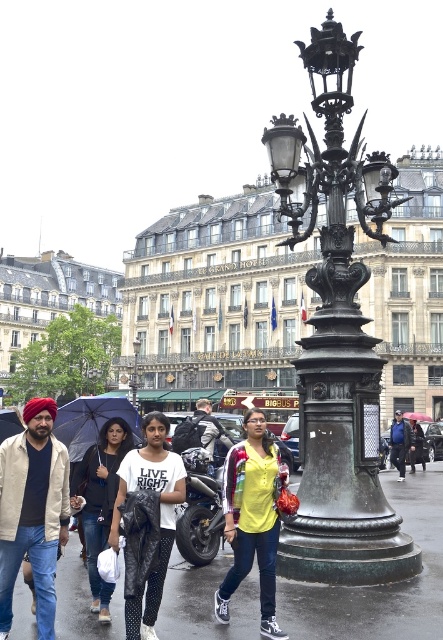
You are a delivery rider who needs to park your motorcycle in a covered area to avoid the rain. Can the shiny black motorcycle at center fit under the transparent plastic umbrella at center?

The shiny black motorcycle at center is below transparent plastic umbrella at center, so yes, it can be parked under the transparent plastic umbrella at center to stay dry.

You are standing in the urban scene and want to walk from the point closer to you to the point further away. Which path would you take? The points are located at coordinates point [338,26] and point [334,598]. Please specify the starting and ending points based on their proximity to you.

The point [338,26] is closer to you, so you would start there and walk towards the point [334,598], which is further away.